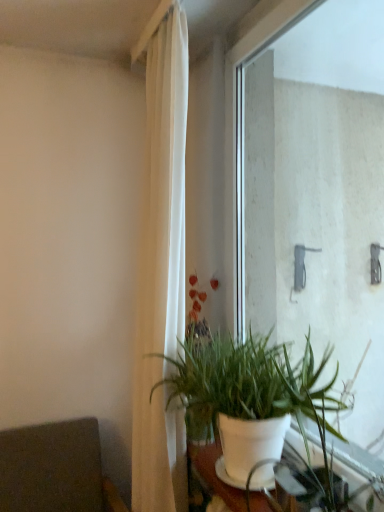
Question: From the image's perspective, does transparent glass window at center appear higher than white fabric curtain at center?

Choices:
 (A) yes
 (B) no

Answer: (A)

Question: From a real-world perspective, does transparent glass window at center stand above white fabric curtain at center?

Choices:
 (A) yes
 (B) no

Answer: (A)

Question: Would you consider transparent glass window at center to be distant from white fabric curtain at center?

Choices:
 (A) no
 (B) yes

Answer: (A)

Question: Does transparent glass window at center come behind white fabric curtain at center?

Choices:
 (A) yes
 (B) no

Answer: (B)

Question: Considering the relative sizes of transparent glass window at center and white fabric curtain at center in the image provided, is transparent glass window at center taller than white fabric curtain at center?

Choices:
 (A) yes
 (B) no

Answer: (B)

Question: Can we say transparent glass window at center lies outside white fabric curtain at center?

Choices:
 (A) no
 (B) yes

Answer: (B)

Question: From a real-world perspective, is dark gray fabric armchair at lower left on transparent glass window at center?

Choices:
 (A) no
 (B) yes

Answer: (A)

Question: Does dark gray fabric armchair at lower left turn towards transparent glass window at center?

Choices:
 (A) no
 (B) yes

Answer: (A)

Question: Does dark gray fabric armchair at lower left have a smaller size compared to transparent glass window at center?

Choices:
 (A) yes
 (B) no

Answer: (B)

Question: Does dark gray fabric armchair at lower left have a greater height compared to transparent glass window at center?

Choices:
 (A) yes
 (B) no

Answer: (B)

Question: Considering the relative sizes of dark gray fabric armchair at lower left and transparent glass window at center in the image provided, is dark gray fabric armchair at lower left bigger than transparent glass window at center?

Choices:
 (A) yes
 (B) no

Answer: (A)

Question: Is dark gray fabric armchair at lower left far away from transparent glass window at center?

Choices:
 (A) no
 (B) yes

Answer: (B)

Question: Does white matte pot at lower center have a lesser height compared to transparent glass window at center?

Choices:
 (A) no
 (B) yes

Answer: (B)